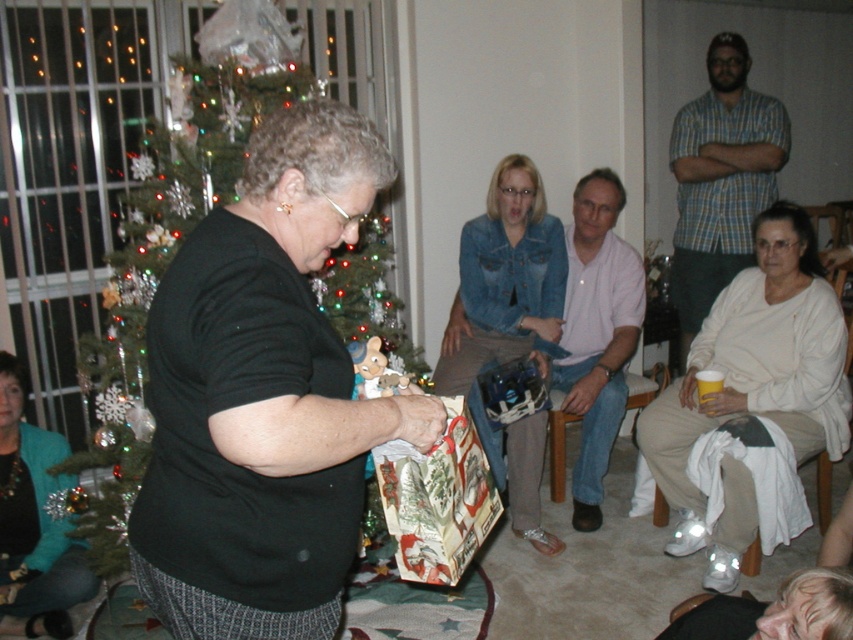
Question: Among these objects, which one is farthest from the camera?

Choices:
 (A) denim jacket at center
 (B) blue plaid shirt at upper right
 (C) green shiny christmas tree at left
 (D) white cotton sweater at lower right

Answer: (B)

Question: Can you confirm if teal fabric jacket at lower left is wider than printed paper bag at center?

Choices:
 (A) yes
 (B) no

Answer: (A)

Question: Observing the image, what is the correct spatial positioning of green shiny christmas tree at left in reference to blue plaid shirt at upper right?

Choices:
 (A) below
 (B) above

Answer: (A)

Question: Which of the following is the farthest from the observer?

Choices:
 (A) (575, 276)
 (B) (466, 536)
 (C) (463, 294)
 (D) (13, 429)

Answer: (A)

Question: Which is nearer to the pink cotton shirt at center?

Choices:
 (A) teal fabric jacket at lower left
 (B) denim jacket at center

Answer: (B)

Question: Can you confirm if denim jacket at center is positioned to the left of blue plaid shirt at upper right?

Choices:
 (A) yes
 (B) no

Answer: (A)